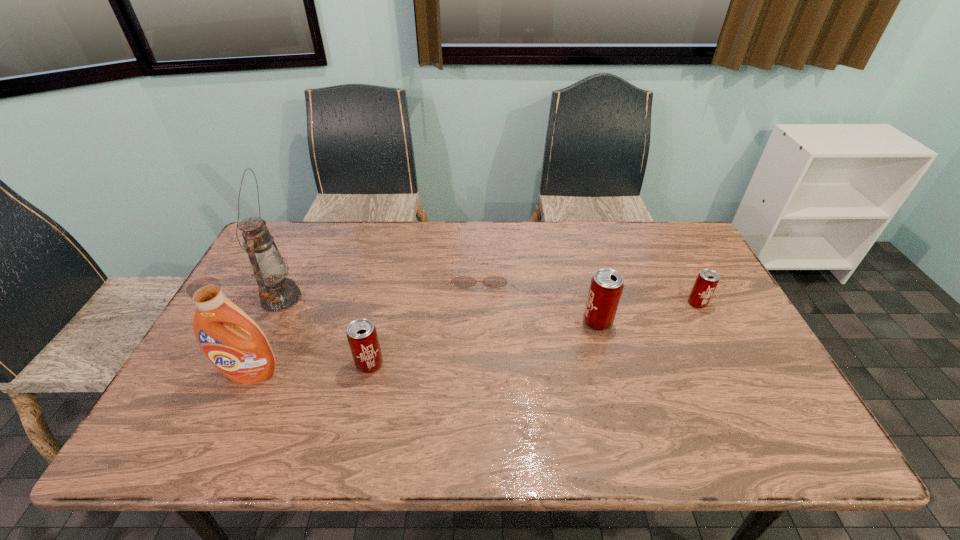
The width and height of the screenshot is (960, 540). Find the location of `free area in between the fifth shortest object and the shortest beer can`. free area in between the fifth shortest object and the shortest beer can is located at coordinates (474, 338).

Locate an element on the screen. The height and width of the screenshot is (540, 960). empty space between the leftmost beer can and the oil lamp is located at coordinates (325, 331).

This screenshot has height=540, width=960. What are the coordinates of `vacant space that's between the second shortest beer can and the rightmost beer can` in the screenshot? It's located at (534, 334).

Where is `free space between the second shortest beer can and the third tallest object`? This screenshot has width=960, height=540. free space between the second shortest beer can and the third tallest object is located at coordinates (484, 343).

Where is `vacant area that lies between the fourth object from right to left and the tallest object`? The height and width of the screenshot is (540, 960). vacant area that lies between the fourth object from right to left and the tallest object is located at coordinates (325, 331).

You are a GUI agent. You are given a task and a screenshot of the screen. Output one action in this format:
    pyautogui.click(x=<x>, y=<y>)
    Task: Click on the vacant space that's between the third object from left to right and the rightmost beer can
    The width and height of the screenshot is (960, 540).
    Given the screenshot: What is the action you would take?
    pyautogui.click(x=534, y=334)

The width and height of the screenshot is (960, 540). Find the location of `empty space between the second tallest object and the tallest object`. empty space between the second tallest object and the tallest object is located at coordinates (266, 336).

Select which object appears as the fourth closest to the tallest object. Please provide its 2D coordinates. Your answer should be formatted as a tuple, i.e. [(x, y)], where the tuple contains the x and y coordinates of a point satisfying the conditions above.

[(606, 286)]

Choose which object is the second nearest neighbor to the second tallest object. Please provide its 2D coordinates. Your answer should be formatted as a tuple, i.e. [(x, y)], where the tuple contains the x and y coordinates of a point satisfying the conditions above.

[(362, 336)]

Image resolution: width=960 pixels, height=540 pixels. In order to click on beer can that is the nearest to the third tallest object in this screenshot , I will do `click(707, 280)`.